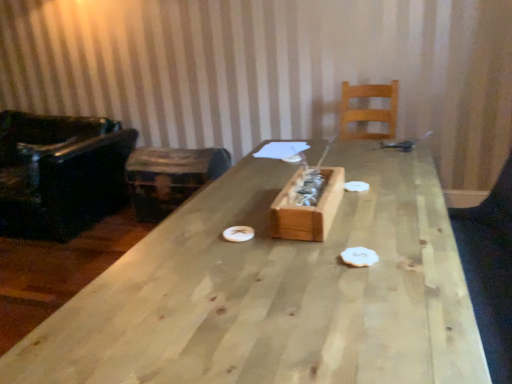
Image resolution: width=512 pixels, height=384 pixels. In order to click on vacant space that is to the left of wooden box at center in this screenshot , I will do `click(222, 222)`.